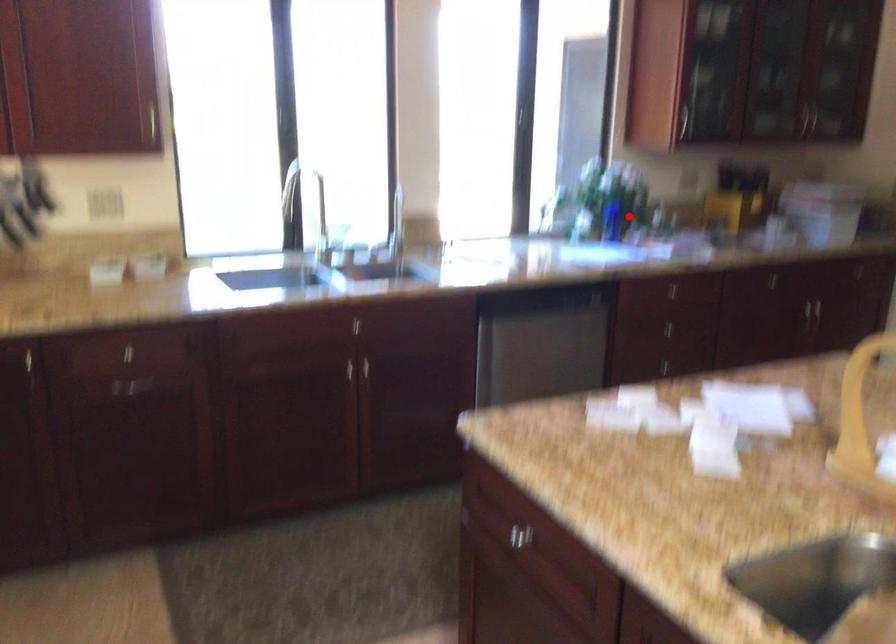
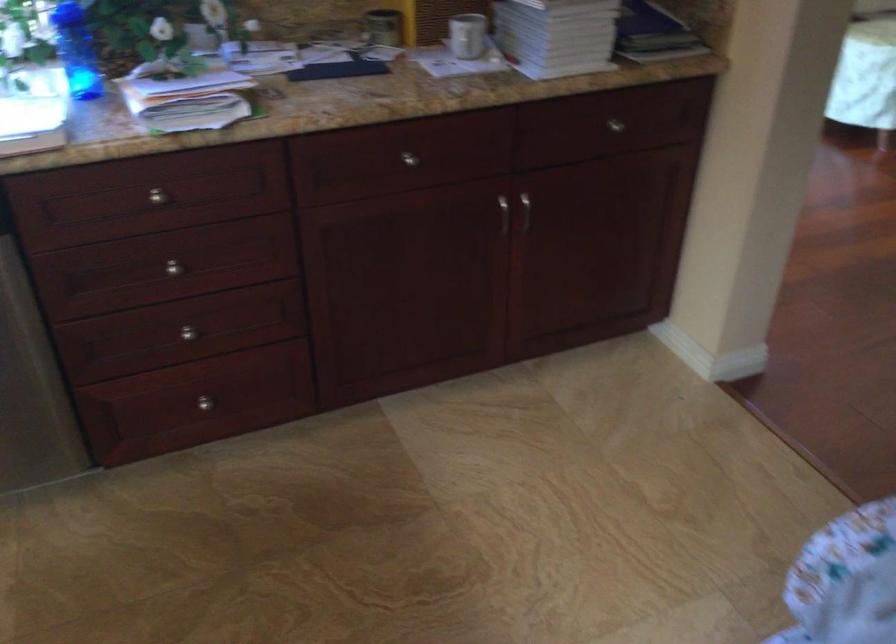
The point at the highlighted location is marked in the first image. Where is the corresponding point in the second image?

(76, 51)